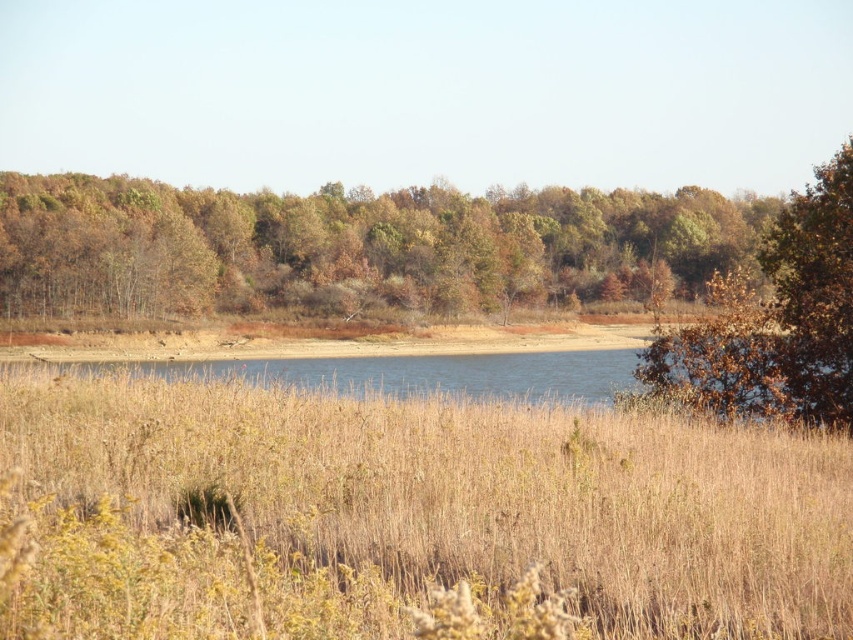
Question: Where is dry grass at center located in relation to brown/dry leaves at center in the image?

Choices:
 (A) right
 (B) left

Answer: (A)

Question: Which point appears farthest from the camera in this image?

Choices:
 (A) (828, 426)
 (B) (33, 291)

Answer: (B)

Question: Can you confirm if dry grass at center is positioned below brown/dry leaves at center?

Choices:
 (A) yes
 (B) no

Answer: (A)

Question: Among these objects, which one is farthest from the camera?

Choices:
 (A) dry grass at center
 (B) blue water at center
 (C) brown leafy bush at right

Answer: (C)

Question: Which object is closer to the camera taking this photo?

Choices:
 (A) blue water at center
 (B) brown/dry leaves at center
 (C) brown leafy bush at right

Answer: (A)

Question: Can you confirm if dry grass at center is positioned to the left of blue water at center?

Choices:
 (A) no
 (B) yes

Answer: (A)